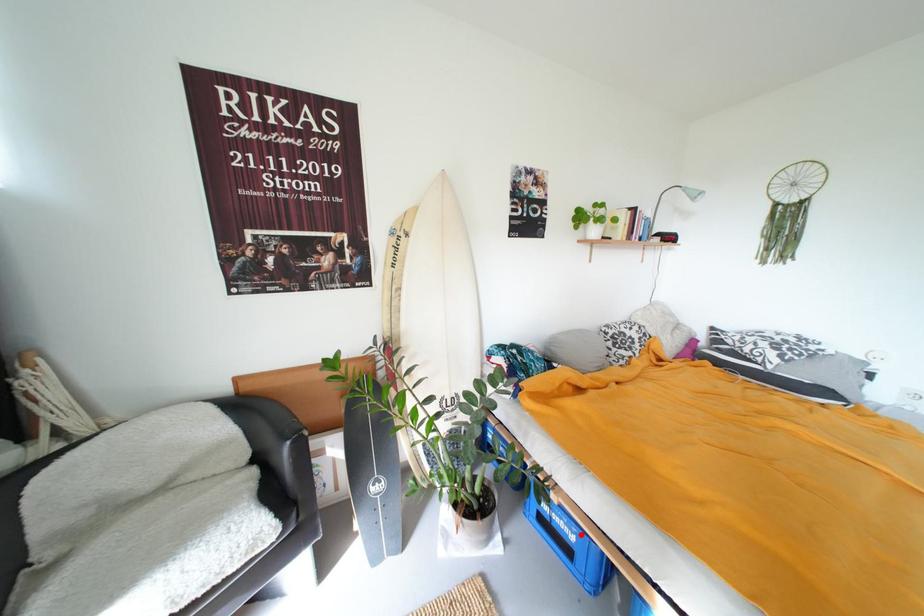
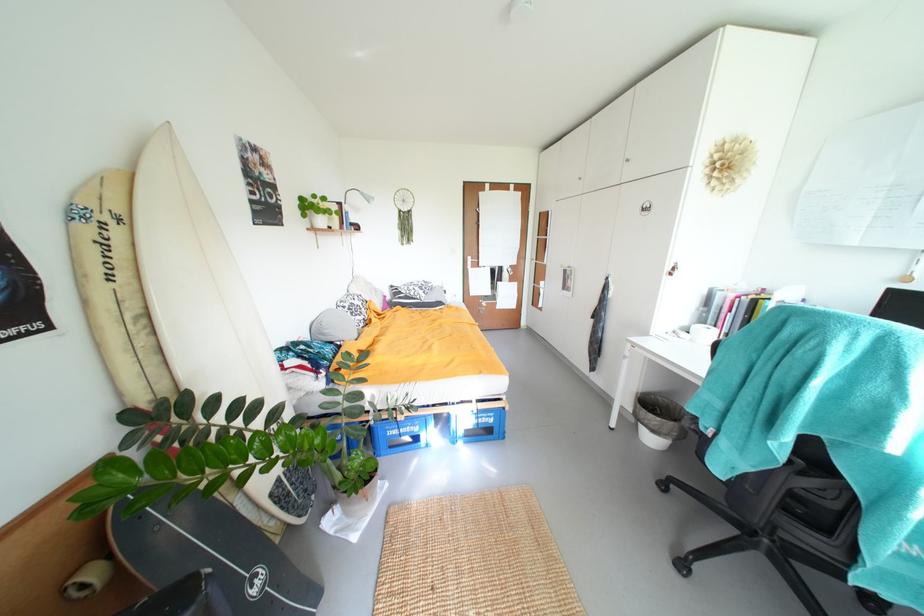
Question: I am providing you with two images of the same scene from different viewpoints. Image1 has a red point marked. In image2, the corresponding 3D location appears at what relative position? Reply with the corresponding letter.

Choices:
 (A) Closer
 (B) Farther

Answer: (B)